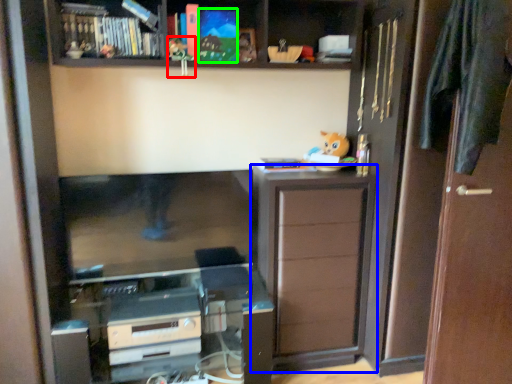
Question: Which object is positioned closest to toy (highlighted by a red box)? Select from cabinetry (highlighted by a blue box) and book (highlighted by a green box).

Choices:
 (A) cabinetry
 (B) book

Answer: (B)